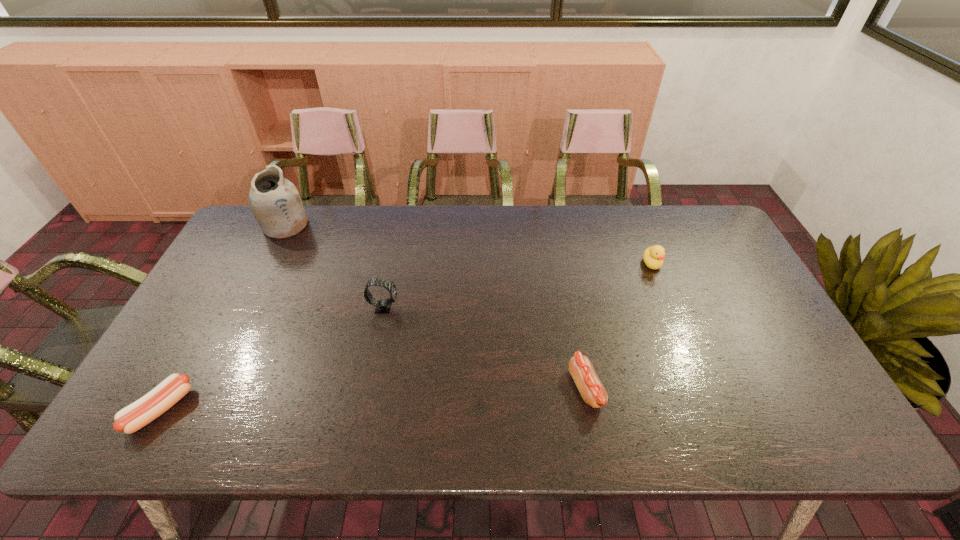
Find the location of a particular element. pottery is located at coordinates (275, 202).

At what (x,y) coordinates should I click in order to perform the action: click on the farthest object. Please return your answer as a coordinate pair (x, y). This screenshot has width=960, height=540. Looking at the image, I should click on (275, 202).

This screenshot has width=960, height=540. What are the coordinates of `the fourth shortest object` in the screenshot? It's located at (383, 306).

At what (x,y) coordinates should I click in order to perform the action: click on the third nearest object. Please return your answer as a coordinate pair (x, y). This screenshot has width=960, height=540. Looking at the image, I should click on (383, 306).

Find the location of a particular element. This screenshot has height=540, width=960. duckling is located at coordinates (653, 256).

You are a GUI agent. You are given a task and a screenshot of the screen. Output one action in this format:
    pyautogui.click(x=<x>, y=<y>)
    Task: Click on the third tallest object
    The image size is (960, 540).
    Given the screenshot: What is the action you would take?
    pyautogui.click(x=653, y=256)

Where is `the fourth object from left to right`? Image resolution: width=960 pixels, height=540 pixels. the fourth object from left to right is located at coordinates (592, 391).

The width and height of the screenshot is (960, 540). I want to click on the second shortest object, so click(592, 391).

You are a GUI agent. You are given a task and a screenshot of the screen. Output one action in this format:
    pyautogui.click(x=<x>, y=<y>)
    Task: Click on the left sausage
    This screenshot has height=540, width=960.
    Given the screenshot: What is the action you would take?
    pyautogui.click(x=133, y=417)

The width and height of the screenshot is (960, 540). Identify the location of the shortest object. (133, 417).